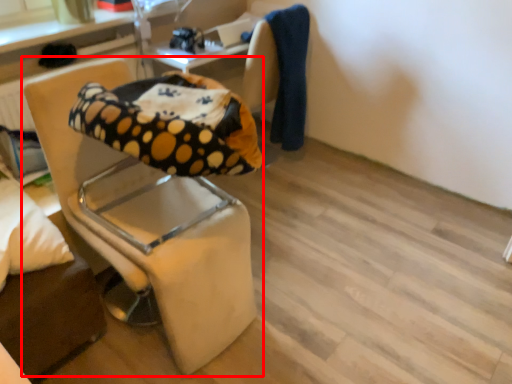
Question: From the image's perspective, considering the relative positions of chair (annotated by the red box) and pillow in the image provided, where is chair (annotated by the red box) located with respect to the staircase?

Choices:
 (A) below
 (B) above

Answer: (B)